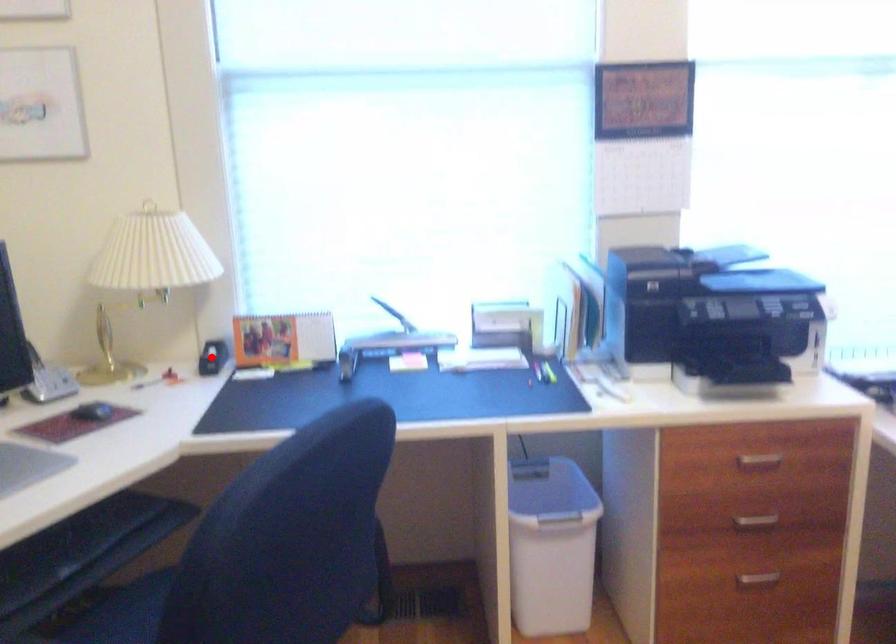
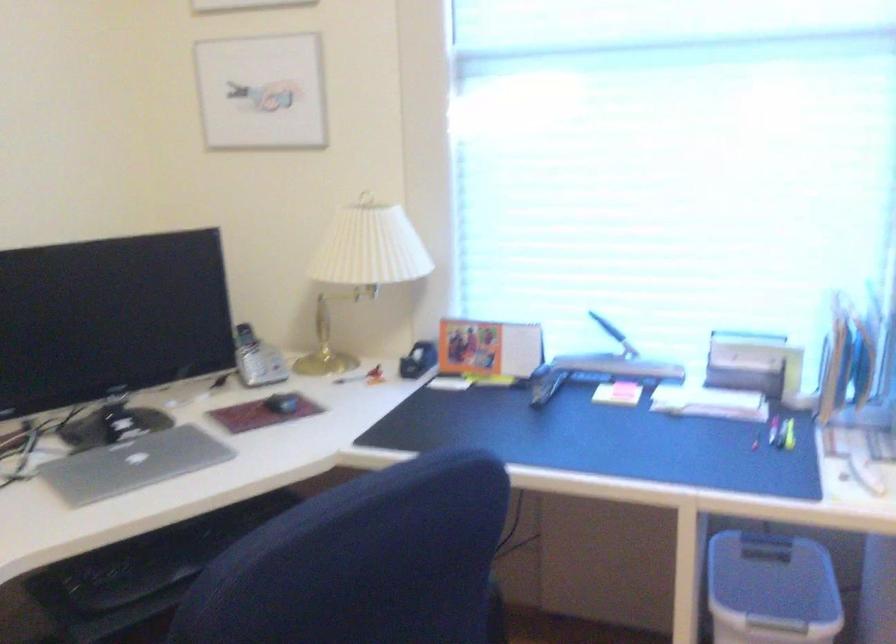
The point at the highlighted location is marked in the first image. Where is the corresponding point in the second image?

(418, 360)